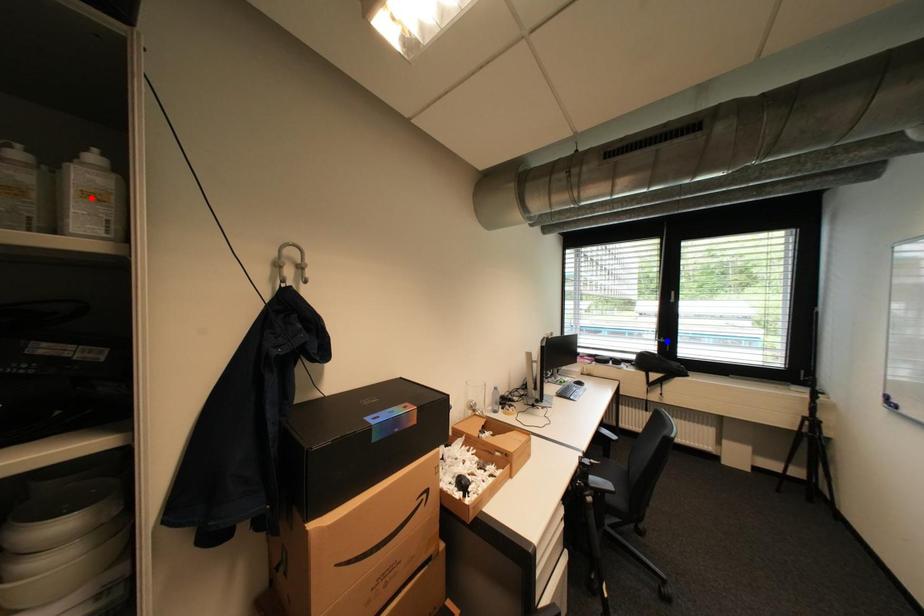
Question: Two points are marked on the image. Which point is closer to the camera?

Choices:
 (A) Blue point is closer.
 (B) Red point is closer.

Answer: (B)